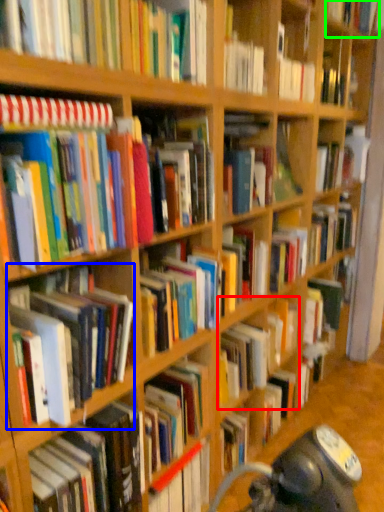
Question: Based on their relative distances, which object is farther from book (highlighted by a red box)? Choose from book (highlighted by a blue box) and book (highlighted by a green box).

Choices:
 (A) book
 (B) book

Answer: (B)